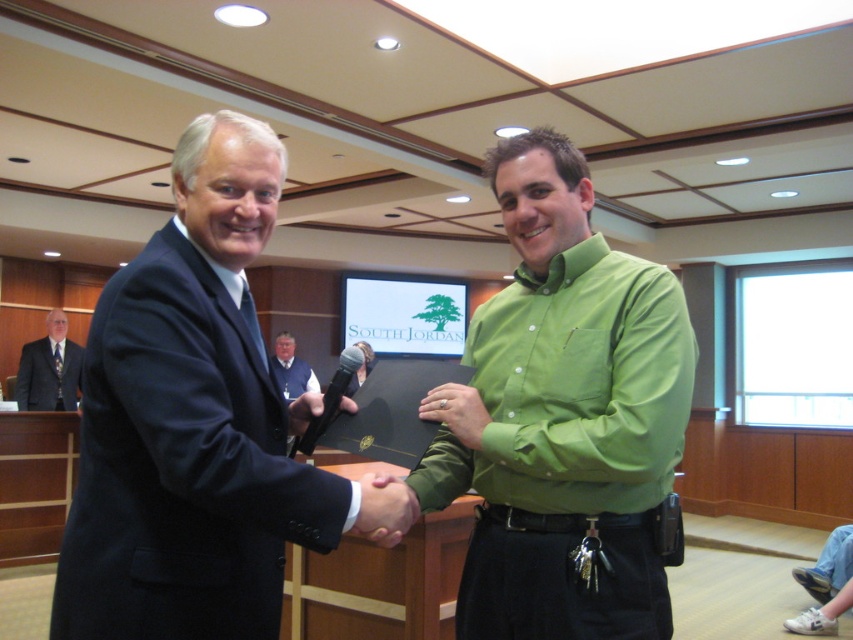
Question: Estimate the real-world distances between objects in this image. Which object is farther from the dark gray suit at center?

Choices:
 (A) green matte hand at center
 (B) dark blue suit at center

Answer: (A)

Question: Is the position of green matte hand at center less distant than that of vest at center?

Choices:
 (A) yes
 (B) no

Answer: (A)

Question: Considering the relative positions of dark gray suit at center and green matte hand at center in the image provided, where is dark gray suit at center located with respect to green matte hand at center?

Choices:
 (A) left
 (B) right

Answer: (A)

Question: Can you confirm if dark gray suit at center is positioned below vest at center?

Choices:
 (A) no
 (B) yes

Answer: (A)

Question: Which point is closer to the camera?

Choices:
 (A) green matte shirt at center
 (B) green matte hand at center

Answer: (B)

Question: Which object appears farthest from the camera in this image?

Choices:
 (A) green matte hand at center
 (B) dark gray suit at center

Answer: (B)